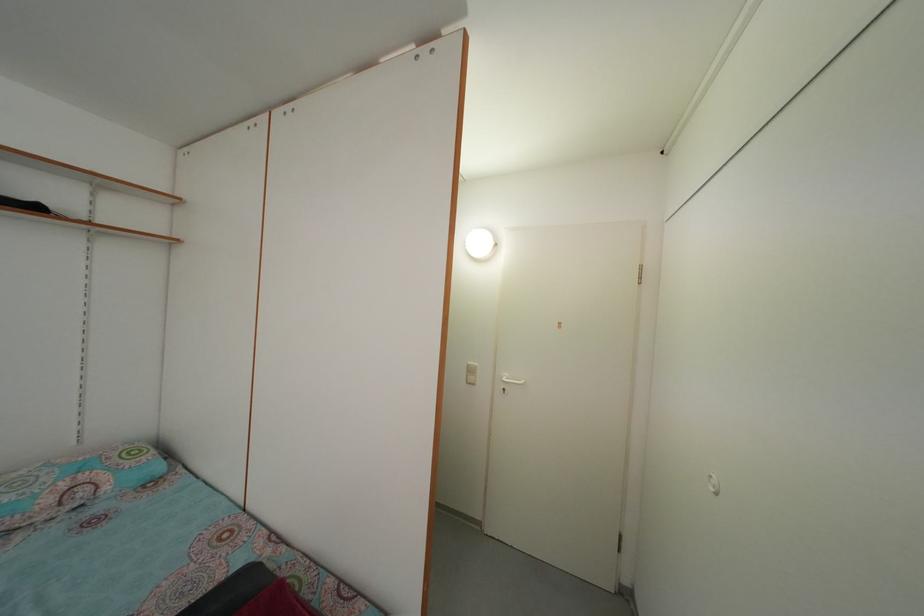
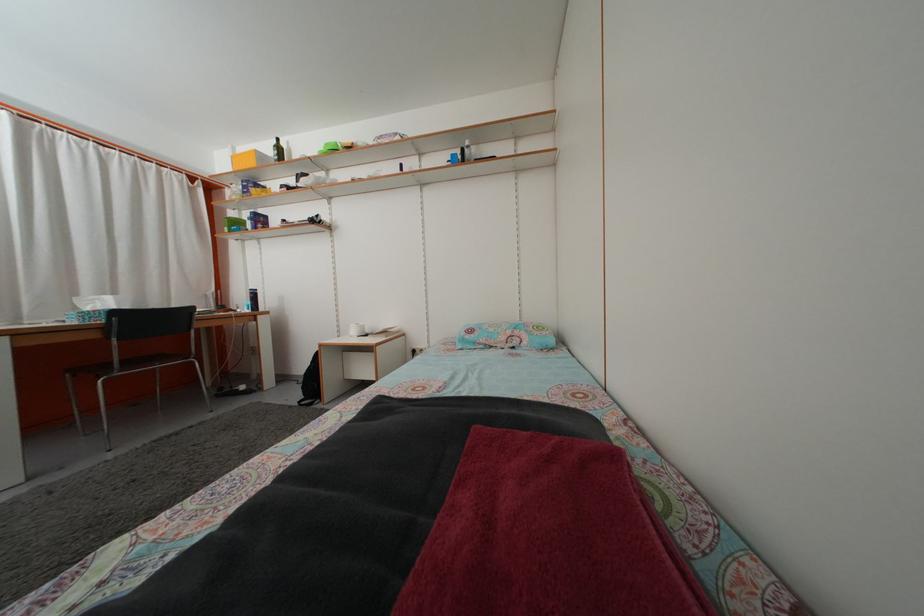
Question: The camera is either moving clockwise (left) or counter-clockwise (right) around the object. The first image is from the beginning of the video and the second image is from the end. Is the camera moving left or right when shooting the video?

Choices:
 (A) Left
 (B) Right

Answer: (B)